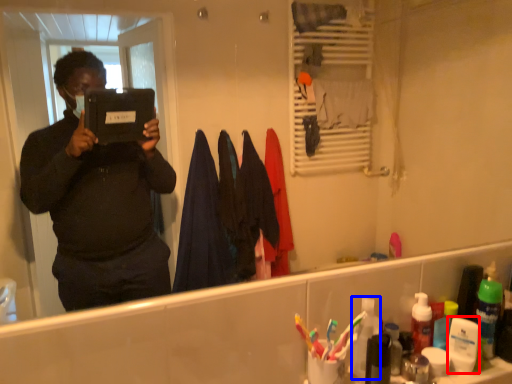
Question: Which object is closer to the camera taking this photo, toiletry (highlighted by a red box) or toiletry (highlighted by a blue box)?

Choices:
 (A) toiletry
 (B) toiletry

Answer: (B)